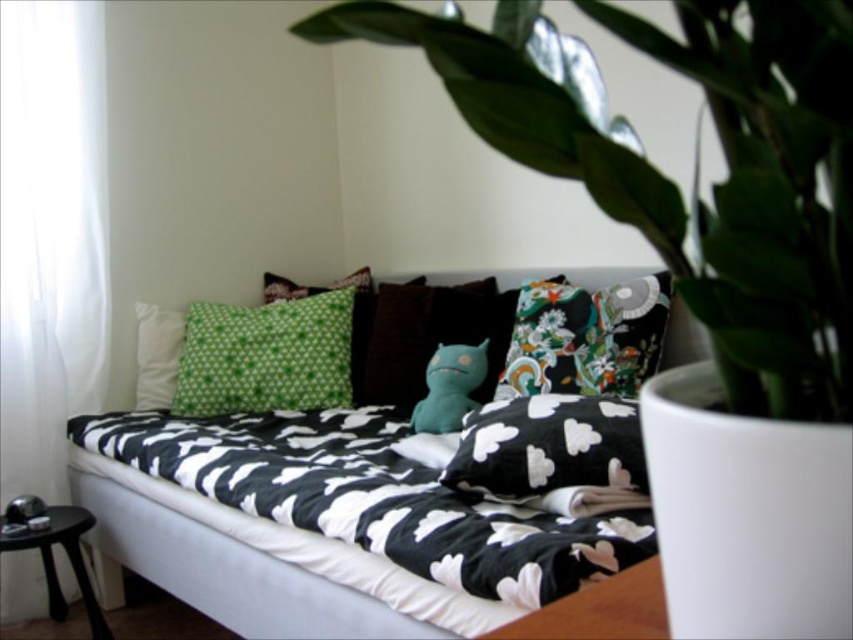
Question: Is black cotton pillow at center above white soft pillow at upper left?

Choices:
 (A) yes
 (B) no

Answer: (B)

Question: Is green leafy plant at upper right thinner than floral fabric pillow at center?

Choices:
 (A) no
 (B) yes

Answer: (B)

Question: Which point appears closest to the camera in this image?

Choices:
 (A) click(x=352, y=308)
 (B) click(x=538, y=298)
 (C) click(x=392, y=300)
 (D) click(x=71, y=550)

Answer: (D)

Question: Which object appears farthest from the camera in this image?

Choices:
 (A) green leafy plant at upper right
 (B) black/white fabric bed at center

Answer: (B)

Question: Which point appears farthest from the camera in this image?

Choices:
 (A) (474, 321)
 (B) (4, 51)

Answer: (A)

Question: Is green fabric pillow at center behind white soft pillow at upper left?

Choices:
 (A) yes
 (B) no

Answer: (B)